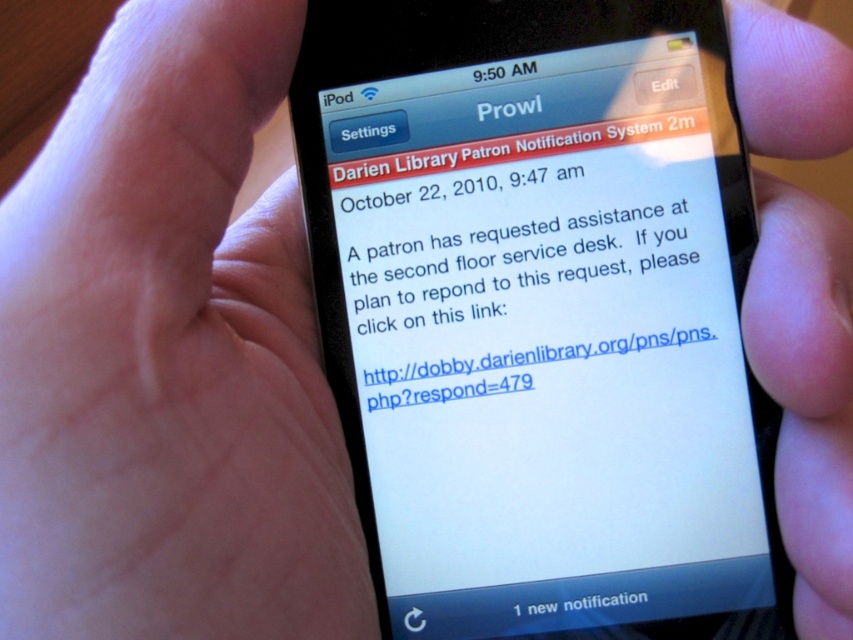
Which is more to the right, white paper text at center or white text at bottom?

white text at bottom

Who is lower down, white paper text at center or white text at bottom?

white text at bottom is lower down.

Is point (416, 259) positioned in front of point (642, 609)?

No, it is behind (642, 609).

Image resolution: width=853 pixels, height=640 pixels. Identify the location of white paper text at center. (535, 284).